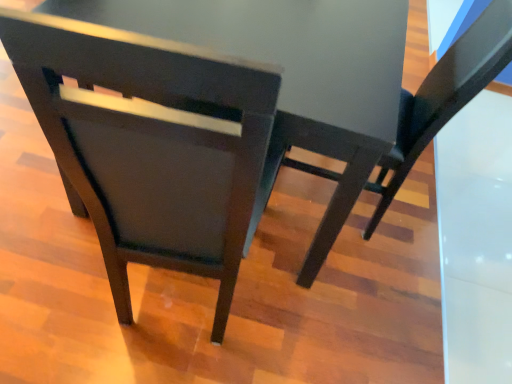
Question: Is matte black chair at center, which is counted as the 1th chair, starting from the left, positioned behind matte black chair at center, positioned as the second chair in left-to-right order?

Choices:
 (A) yes
 (B) no

Answer: (B)

Question: Can you confirm if matte black chair at center, which is the 2th chair from right to left, is bigger than matte black chair at center, positioned as the second chair in left-to-right order?

Choices:
 (A) yes
 (B) no

Answer: (A)

Question: From a real-world perspective, does matte black chair at center, which is the 2th chair from right to left, sit lower than matte black chair at center, positioned as the second chair in left-to-right order?

Choices:
 (A) no
 (B) yes

Answer: (A)

Question: Can you confirm if matte black chair at center, which is counted as the 1th chair, starting from the left, is positioned to the right of matte black chair at center, acting as the first chair starting from the right?

Choices:
 (A) no
 (B) yes

Answer: (A)

Question: Is matte black chair at center, which is the 2th chair from right to left, oriented away from matte black chair at center, positioned as the second chair in left-to-right order?

Choices:
 (A) no
 (B) yes

Answer: (A)

Question: From the image's perspective, is matte black chair at center, which is the 2th chair from right to left, on top of matte black chair at center, positioned as the second chair in left-to-right order?

Choices:
 (A) no
 (B) yes

Answer: (A)

Question: Does matte black chair at center, acting as the first chair starting from the right, have a lesser height compared to matte black chair at center, which is counted as the 1th chair, starting from the left?

Choices:
 (A) no
 (B) yes

Answer: (B)

Question: Is matte black chair at center, acting as the first chair starting from the right, positioned in front of matte black chair at center, which is counted as the 1th chair, starting from the left?

Choices:
 (A) no
 (B) yes

Answer: (A)

Question: Considering the relative sizes of matte black chair at center, acting as the first chair starting from the right, and matte black chair at center, which is counted as the 1th chair, starting from the left, in the image provided, is matte black chair at center, acting as the first chair starting from the right, thinner than matte black chair at center, which is counted as the 1th chair, starting from the left,?

Choices:
 (A) yes
 (B) no

Answer: (B)

Question: Is matte black chair at center, which is the 2th chair from right to left, inside matte black chair at center, acting as the first chair starting from the right?

Choices:
 (A) yes
 (B) no

Answer: (B)

Question: Is there a large distance between matte black chair at center, positioned as the second chair in left-to-right order, and matte black chair at center, which is the 2th chair from right to left?

Choices:
 (A) yes
 (B) no

Answer: (B)

Question: From a real-world perspective, is matte black chair at center, positioned as the second chair in left-to-right order, on matte black chair at center, which is counted as the 1th chair, starting from the left?

Choices:
 (A) yes
 (B) no

Answer: (B)

Question: Considering the positions of point (144, 253) and point (451, 94), is point (144, 253) closer or farther from the camera than point (451, 94)?

Choices:
 (A) farther
 (B) closer

Answer: (B)